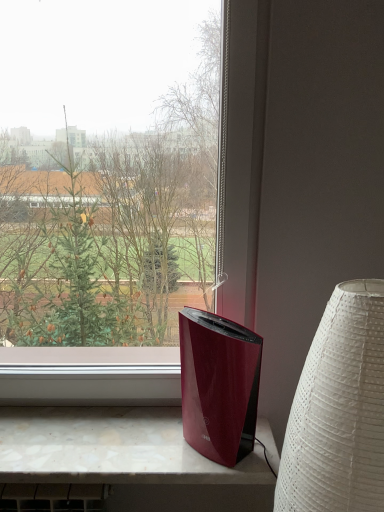
Question: Does white textured lampshade at right appear on the right side of marble-like surface at lower center?

Choices:
 (A) yes
 (B) no

Answer: (A)

Question: Is white textured lampshade at right oriented towards marble-like surface at lower center?

Choices:
 (A) no
 (B) yes

Answer: (A)

Question: Is white textured lampshade at right far from marble-like surface at lower center?

Choices:
 (A) yes
 (B) no

Answer: (B)

Question: Is marble-like surface at lower center located within white textured lampshade at right?

Choices:
 (A) no
 (B) yes

Answer: (A)

Question: Does white textured lampshade at right have a larger size compared to marble-like surface at lower center?

Choices:
 (A) no
 (B) yes

Answer: (B)

Question: Is white textured lampshade at right turned away from marble-like surface at lower center?

Choices:
 (A) yes
 (B) no

Answer: (B)

Question: Is marble-like surface at lower center aimed at white textured lampshade at right?

Choices:
 (A) no
 (B) yes

Answer: (A)

Question: Is marble-like surface at lower center thinner than white textured lampshade at right?

Choices:
 (A) no
 (B) yes

Answer: (B)

Question: From the image's perspective, is marble-like surface at lower center under white textured lampshade at right?

Choices:
 (A) no
 (B) yes

Answer: (B)

Question: Considering the relative sizes of marble-like surface at lower center and white textured lampshade at right in the image provided, is marble-like surface at lower center bigger than white textured lampshade at right?

Choices:
 (A) yes
 (B) no

Answer: (B)

Question: Is marble-like surface at lower center far from white textured lampshade at right?

Choices:
 (A) yes
 (B) no

Answer: (B)

Question: Can we say marble-like surface at lower center lies outside white textured lampshade at right?

Choices:
 (A) yes
 (B) no

Answer: (A)

Question: Would you say white textured lampshade at right is inside or outside marble-like surface at lower center?

Choices:
 (A) outside
 (B) inside

Answer: (A)